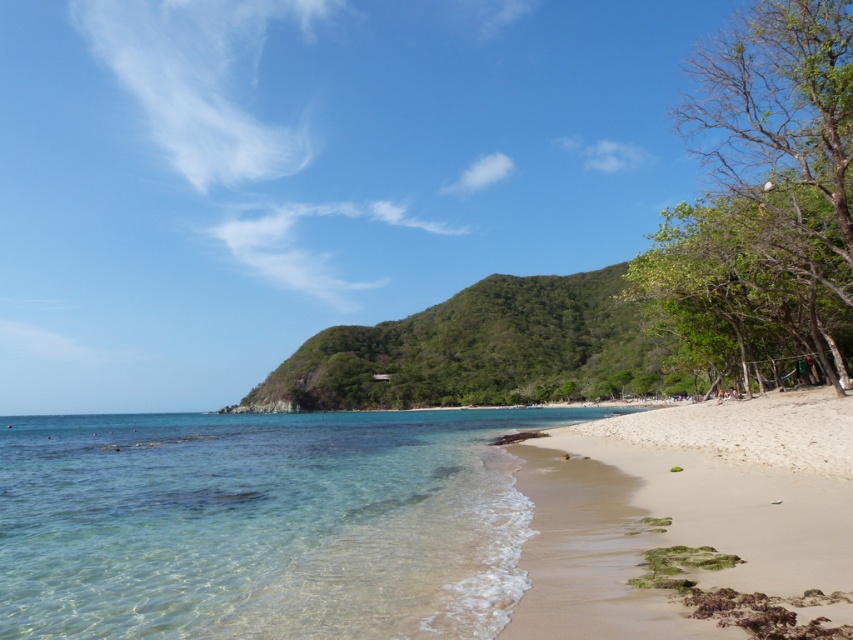
You are standing at the center of the beach and want to reach the clear water at lower left. Which direction should you walk to get there?

You should walk towards the lower left direction to reach the clear water at lower left.